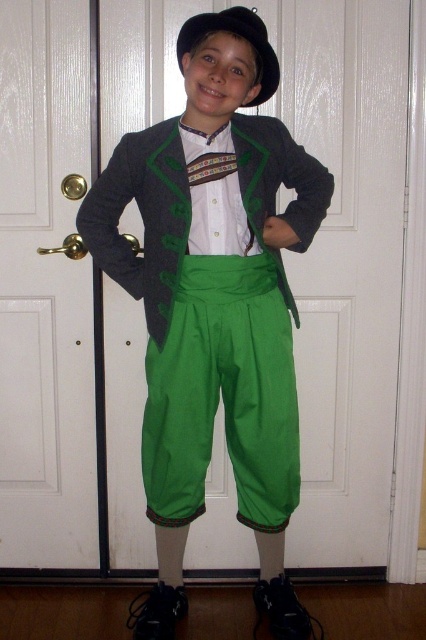
Question: Is dark gray wool jacket at center positioned before black felt hat at upper center?

Choices:
 (A) no
 (B) yes

Answer: (A)

Question: Is matte green pants at center thinner than black felt hat at upper center?

Choices:
 (A) yes
 (B) no

Answer: (B)

Question: Estimate the real-world distances between objects in this image. Which object is closer to the matte green pants at center?

Choices:
 (A) dark gray wool jacket at center
 (B) black felt hat at upper center

Answer: (A)

Question: Is matte green pants at center above dark gray wool jacket at center?

Choices:
 (A) yes
 (B) no

Answer: (B)

Question: Which object is positioned farthest from the dark gray wool jacket at center?

Choices:
 (A) black felt hat at upper center
 (B) matte green pants at center

Answer: (A)

Question: Which point is closer to the camera?

Choices:
 (A) (175, 531)
 (B) (322, 216)

Answer: (B)